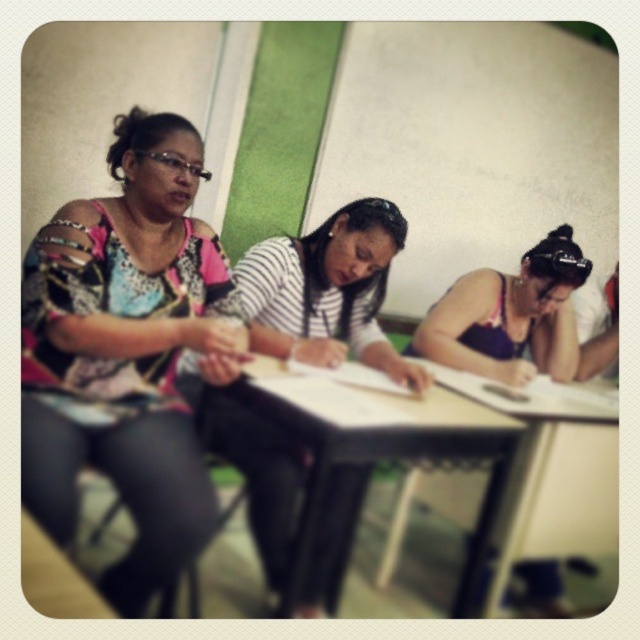
Question: Can you confirm if black plastic table at center is wider than wooden table at lower center?

Choices:
 (A) yes
 (B) no

Answer: (A)

Question: Which point is closer to the camera?

Choices:
 (A) (538, 602)
 (B) (394, 368)

Answer: (B)

Question: Does black plastic table at center come in front of wooden table at lower center?

Choices:
 (A) yes
 (B) no

Answer: (B)

Question: Which point is closer to the camera?

Choices:
 (A) black plastic table at center
 (B) wooden table at lower center

Answer: (B)

Question: Can you confirm if purple fabric hairband at center is thinner than wooden table at lower center?

Choices:
 (A) yes
 (B) no

Answer: (B)

Question: Among these objects, which one is nearest to the camera?

Choices:
 (A) purple fabric hairband at center
 (B) wooden table at lower center
 (C) multicolored printed blouse at left

Answer: (B)